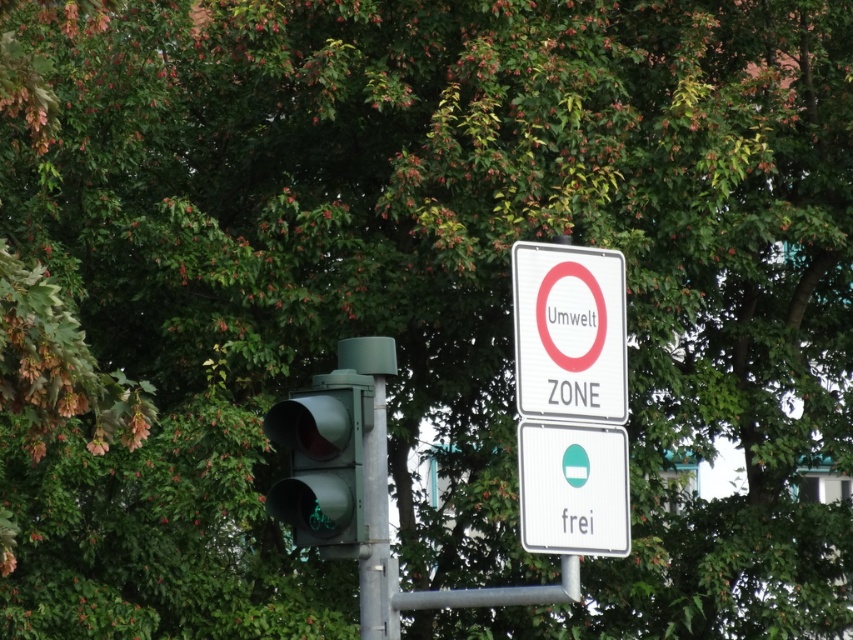
Looking at this image, can you confirm if green matte traffic light at center is thinner than white plastic sign at center?

Indeed, green matte traffic light at center has a lesser width compared to white plastic sign at center.

Is point (328, 419) behind point (605, 481)?

No.

The image size is (853, 640). Describe the element at coordinates (321, 460) in the screenshot. I see `green matte traffic light at center` at that location.

Locate an element on the screen. The height and width of the screenshot is (640, 853). green matte traffic light at center is located at coordinates (321, 460).

Can you confirm if white plastic sign at upper center is bigger than green matte traffic light at center?

Correct, white plastic sign at upper center is larger in size than green matte traffic light at center.

Who is shorter, white plastic sign at upper center or green matte traffic light at center?

green matte traffic light at center

Find the location of a particular element. white plastic sign at upper center is located at coordinates (569, 332).

Between white plastic sign at upper center and white plastic sign at center, which one appears on the right side from the viewer's perspective?

Positioned to the right is white plastic sign at center.

What do you see at coordinates (569, 332) in the screenshot? The width and height of the screenshot is (853, 640). I see `white plastic sign at upper center` at bounding box center [569, 332].

You are a GUI agent. You are given a task and a screenshot of the screen. Output one action in this format:
    pyautogui.click(x=<x>, y=<y>)
    Task: Click on the white plastic sign at upper center
    The height and width of the screenshot is (640, 853).
    Given the screenshot: What is the action you would take?
    pyautogui.click(x=569, y=332)